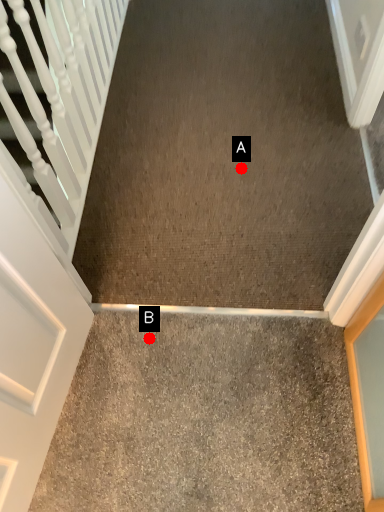
Question: Two points are circled on the image, labeled by A and B beside each circle. Among these points, which one is farthest from the camera?

Choices:
 (A) A is further
 (B) B is further

Answer: (A)